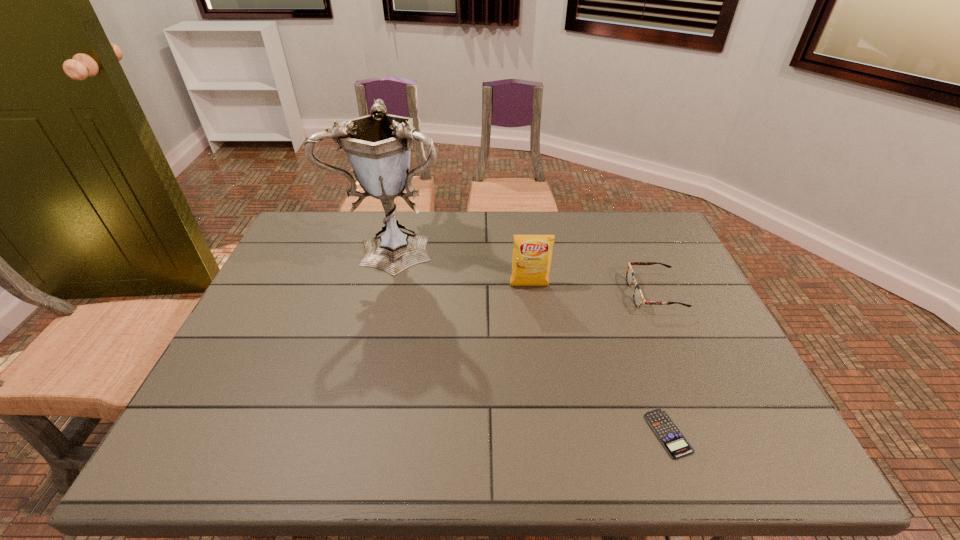
Image resolution: width=960 pixels, height=540 pixels. I want to click on blank space located 0.300m on the frame of the spectacles, so click(x=523, y=293).

Find the location of a particular element. vacant space located on the frame of the spectacles is located at coordinates (569, 293).

This screenshot has width=960, height=540. Find the location of `vacant space situated on the left of the nearest object`. vacant space situated on the left of the nearest object is located at coordinates (492, 434).

You are a GUI agent. You are given a task and a screenshot of the screen. Output one action in this format:
    pyautogui.click(x=<x>, y=<y>)
    Task: Click on the object at the far edge
    
    Given the screenshot: What is the action you would take?
    pyautogui.click(x=378, y=146)

Find the location of a particular element. This screenshot has height=540, width=960. object present at the near edge is located at coordinates (672, 439).

Locate an element on the screen. The image size is (960, 540). object at the right edge is located at coordinates (638, 298).

In the image, there is a desktop. Identify the location of vacant area at the far edge. The width and height of the screenshot is (960, 540). (509, 224).

In the image, there is a desktop. Where is `vacant space at the near edge`? vacant space at the near edge is located at coordinates (653, 443).

This screenshot has width=960, height=540. I want to click on free space at the left edge of the desktop, so click(x=271, y=352).

Image resolution: width=960 pixels, height=540 pixels. Identify the location of free spot at the far left corner of the desktop. (336, 211).